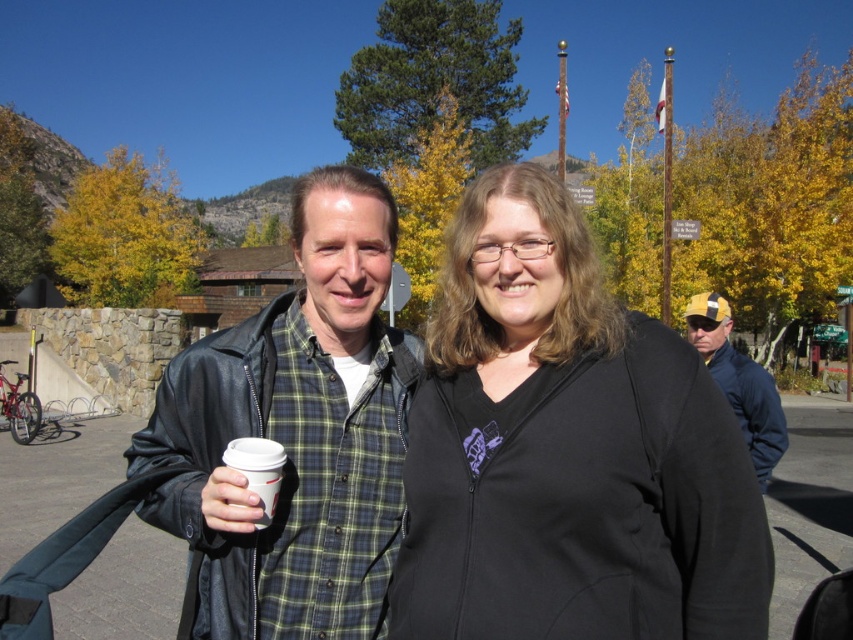
Question: Which is nearer to the yellow cap at right?

Choices:
 (A) white paper cup at center
 (B) black zip-up hoodie at center

Answer: (B)

Question: Is yellow cap at right bigger than white paper cup at center?

Choices:
 (A) yes
 (B) no

Answer: (A)

Question: Which point is farther to the camera?

Choices:
 (A) (585, 515)
 (B) (328, 563)
 (C) (773, 381)
 (D) (242, 436)

Answer: (C)

Question: Which object is the farthest from the white paper cup at center?

Choices:
 (A) black zip-up hoodie at center
 (B) leather jacket at center
 (C) yellow cap at right

Answer: (C)

Question: Is black zip-up hoodie at center wider than white paper cup at center?

Choices:
 (A) no
 (B) yes

Answer: (B)

Question: Is black zip-up hoodie at center smaller than yellow cap at right?

Choices:
 (A) yes
 (B) no

Answer: (B)